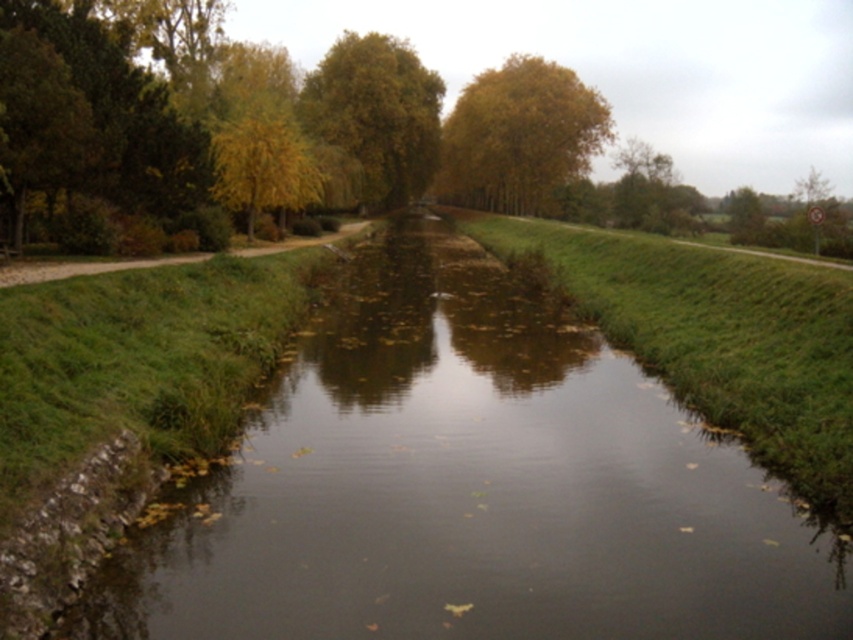
Question: Which object appears farthest from the camera in this image?

Choices:
 (A) yellow-green foliage at upper center
 (B) yellow leafy tree at center

Answer: (A)

Question: Is brown grassy stream at center in front of yellow leafy tree at upper center?

Choices:
 (A) yes
 (B) no

Answer: (A)

Question: Can you confirm if yellow leafy tree at upper center is positioned to the left of yellow leafy tree at center?

Choices:
 (A) no
 (B) yes

Answer: (A)

Question: Considering the real-world distances, which object is farthest from the brown grassy stream at center?

Choices:
 (A) yellow leafy tree at center
 (B) yellow-green foliage at upper center
 (C) yellow leafy tree at upper center

Answer: (C)

Question: Observing the image, what is the correct spatial positioning of yellow leafy tree at upper center in reference to yellow leafy tree at center?

Choices:
 (A) above
 (B) below

Answer: (A)

Question: Among these points, which one is farthest from the camera?

Choices:
 (A) (250, 204)
 (B) (383, 60)

Answer: (B)